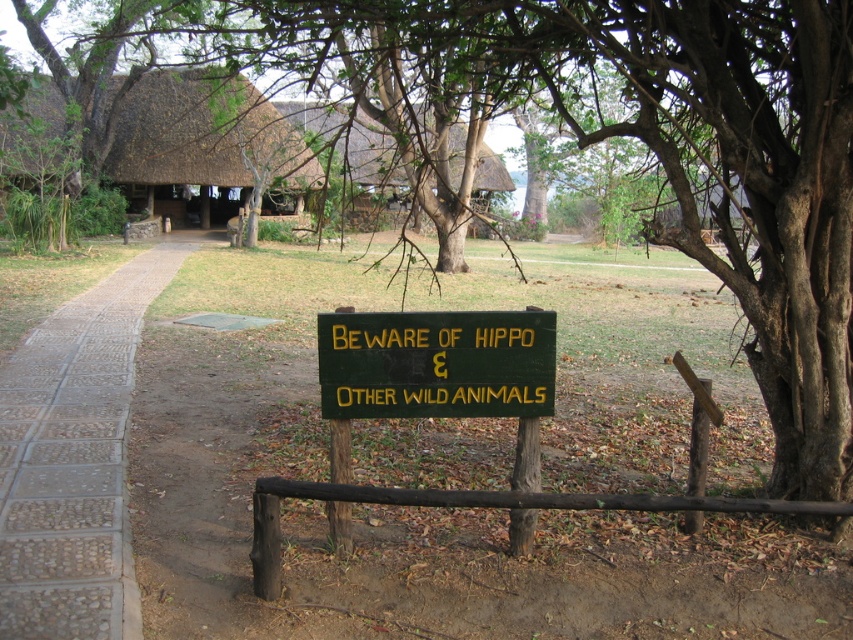
You are a guest staying at the safari lodge and want to take a walk along the pathway. You see the pebble stone path at left and the green painted wood sign at center. Which one of these two objects is bigger in size?

The pebble stone path at left is larger in size than the green painted wood sign at center.

You are a visitor at the safari lodge and need to find the entrance to the thatched roof hut at upper center. You see the green painted wood sign at center. Which direction should you walk relative to the sign to reach the entrance?

The green painted wood sign at center is positioned under the thatched roof hut at upper center, so the entrance is directly above the sign. Walk towards the direction where the sign is facing to reach the entrance.

You are a visitor at the safari lodge and want to reach the thatched roof hut at upper center. Which direction should you walk from the pebble stone path at left to get there?

To reach the thatched roof hut at upper center from the pebble stone path at left, you should walk to the right since the path is positioned to the left of the hut.